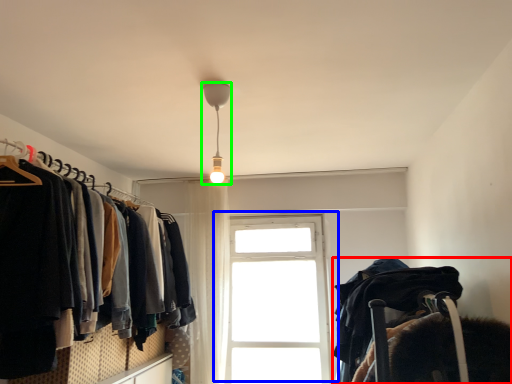
Question: Considering the real-world distances, which object is closest to bunk bed (highlighted by a red box)? window (highlighted by a blue box) or lamp (highlighted by a green box).

Choices:
 (A) window
 (B) lamp

Answer: (B)